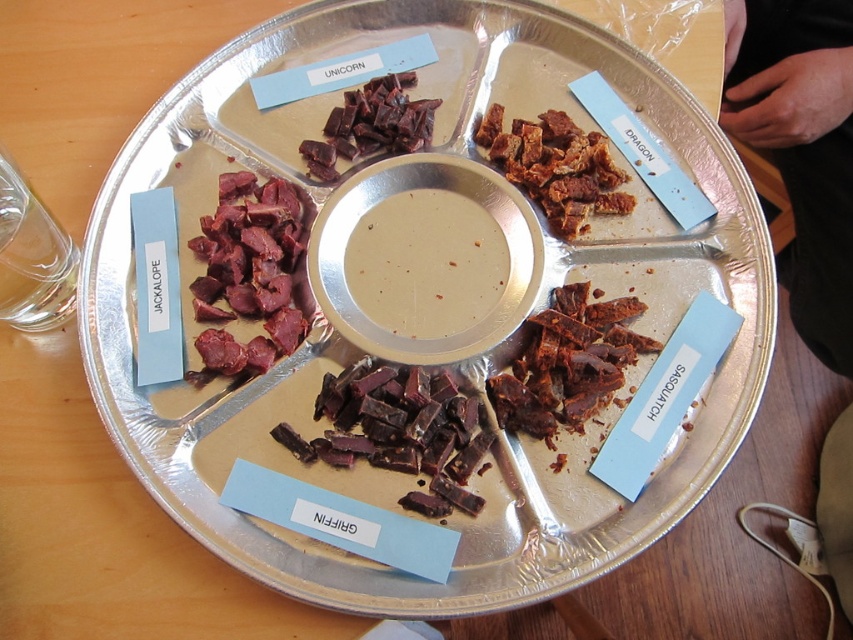
Question: Which point is closer to the camera taking this photo?

Choices:
 (A) (596, 168)
 (B) (273, 202)
 (C) (410, 109)
 (D) (570, 316)

Answer: (D)

Question: Is brown crispy jerky at center positioned at the back of dark brown chewy meat at upper center?

Choices:
 (A) yes
 (B) no

Answer: (B)

Question: Which point appears closest to the camera in this image?

Choices:
 (A) (576, 301)
 (B) (343, 444)
 (C) (380, 109)
 (D) (579, 129)

Answer: (B)

Question: Considering the real-world distances, which object is closest to the brown crumbly snack at upper right?

Choices:
 (A) dark red meat at lower left
 (B) brown crispy jerky at center

Answer: (B)

Question: Does brown crispy jerky at center have a smaller size compared to dark brown chewy meat at upper center?

Choices:
 (A) no
 (B) yes

Answer: (A)

Question: Can you confirm if dark red meat at lower left is bigger than brown crispy jerky at center?

Choices:
 (A) no
 (B) yes

Answer: (B)